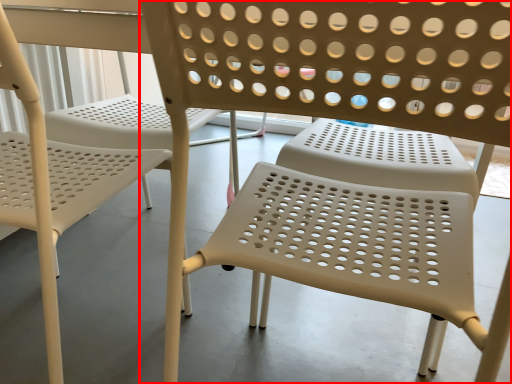
Question: Considering the relative positions of chair (annotated by the red box) and chair in the image provided, where is chair (annotated by the red box) located with respect to the staircase?

Choices:
 (A) left
 (B) right

Answer: (B)